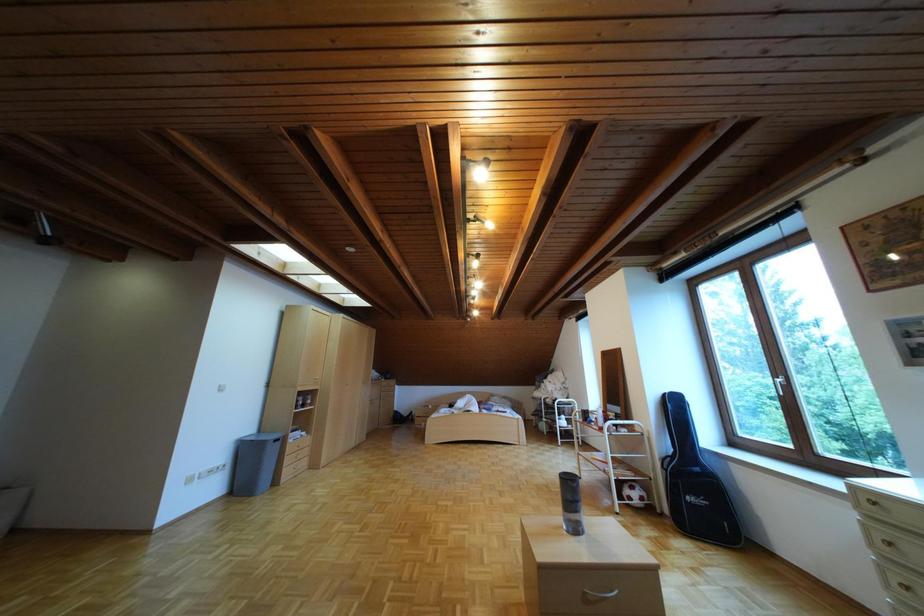
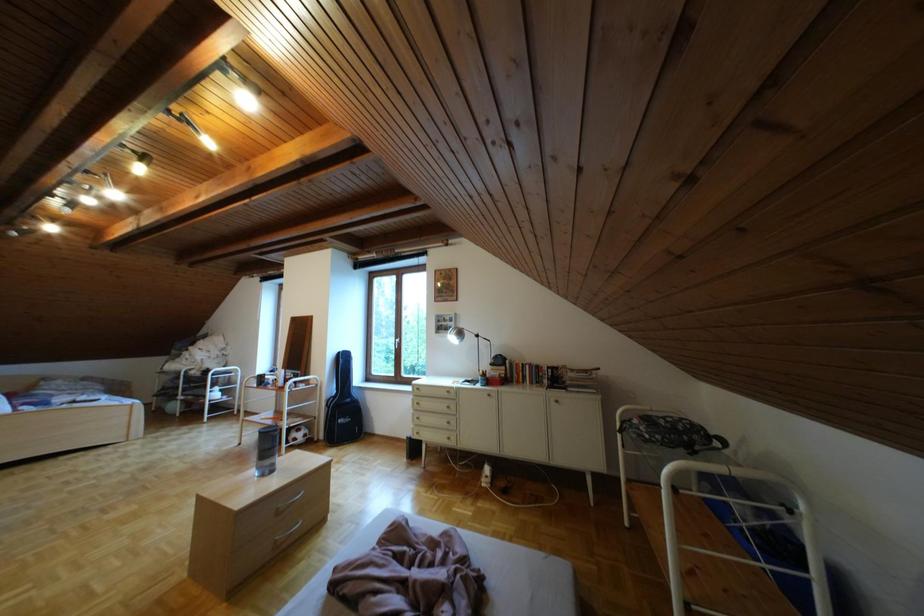
Question: The images are taken continuously from a first-person perspective. In which direction is your viewpoint rotating?

Choices:
 (A) Left
 (B) Right
 (C) Up
 (D) Down

Answer: (B)